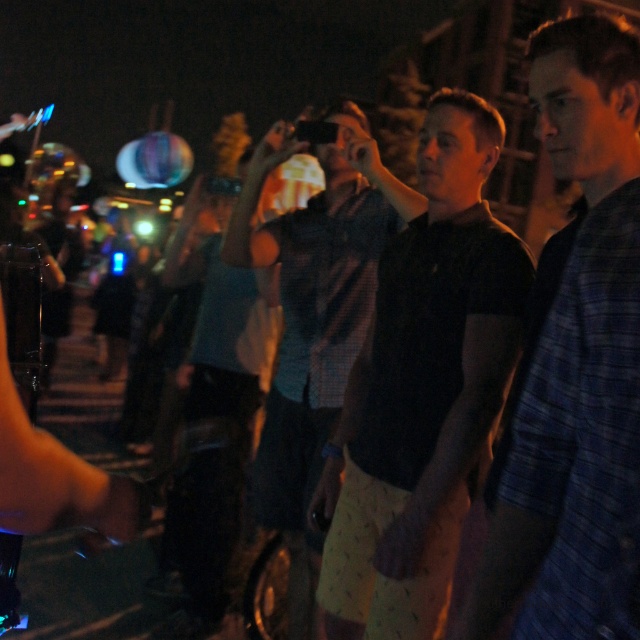
Question: Does blue plaid shirt at center appear on the right side of dark plaid shirt at center?

Choices:
 (A) no
 (B) yes

Answer: (B)

Question: Which object appears farthest from the camera in this image?

Choices:
 (A) black matte shorts at center
 (B) blue plaid shirt at center
 (C) dark plaid shirt at center
 (D) plaid shirt at center

Answer: (D)

Question: Which object is positioned closest to the black matte shorts at center?

Choices:
 (A) plaid shirt at center
 (B) blue plaid shirt at center

Answer: (B)

Question: Which object is farther from the camera taking this photo?

Choices:
 (A) dark plaid shirt at center
 (B) plaid shirt at center
 (C) black matte shorts at center
 (D) blue plaid shirt at center

Answer: (B)

Question: Can you confirm if plaid shirt at center is smaller than blue plaid shirt at center?

Choices:
 (A) no
 (B) yes

Answer: (A)

Question: Does blue plaid shirt at center come in front of dark plaid shirt at center?

Choices:
 (A) no
 (B) yes

Answer: (B)